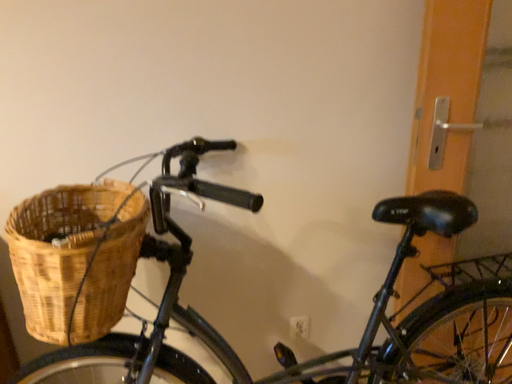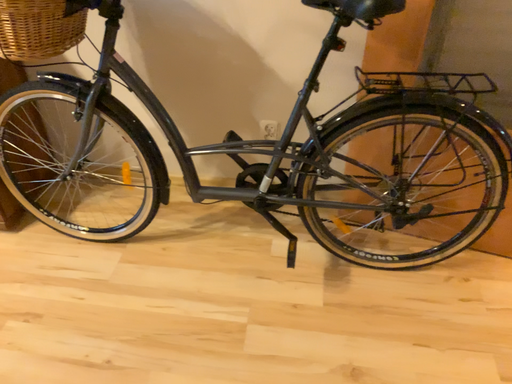
Question: Which way did the camera rotate in the video?

Choices:
 (A) rotated left
 (B) rotated right

Answer: (A)